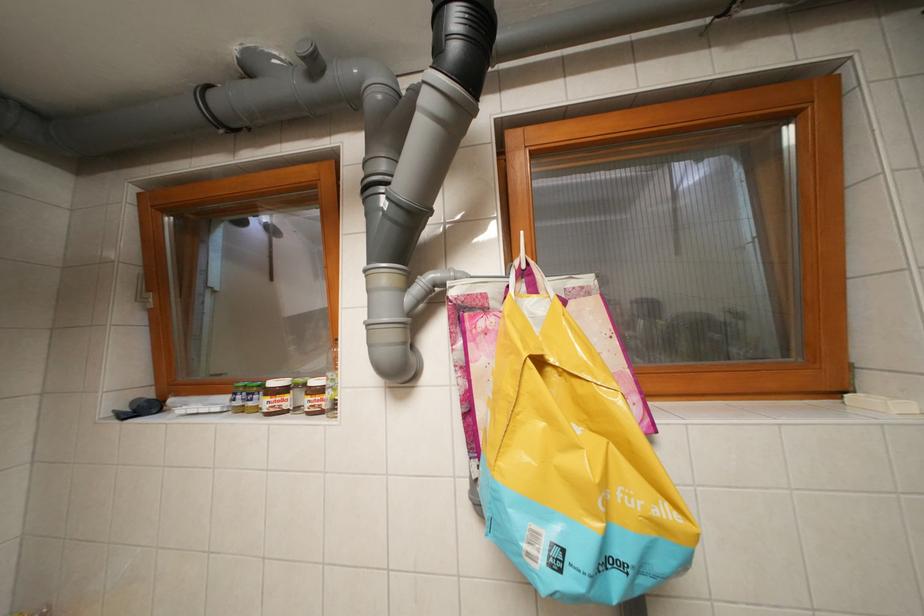
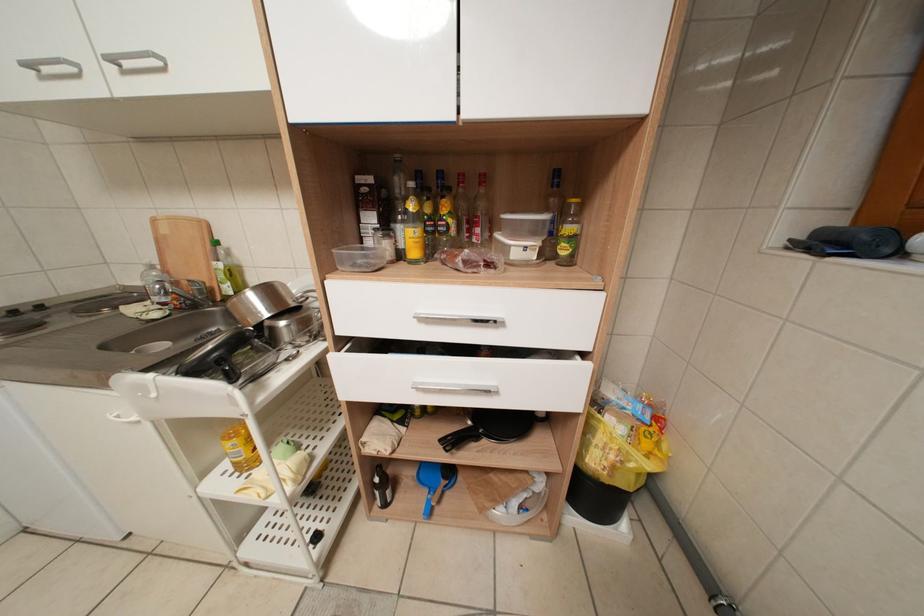
The first image is from the beginning of the video and the second image is from the end. How did the camera likely rotate when shooting the video?

The rotation direction of the camera is left-down.